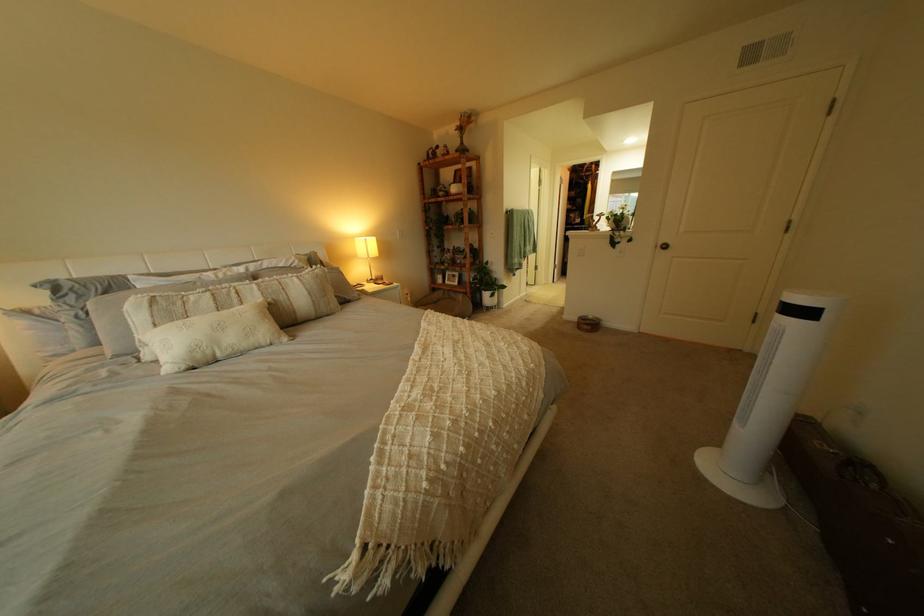
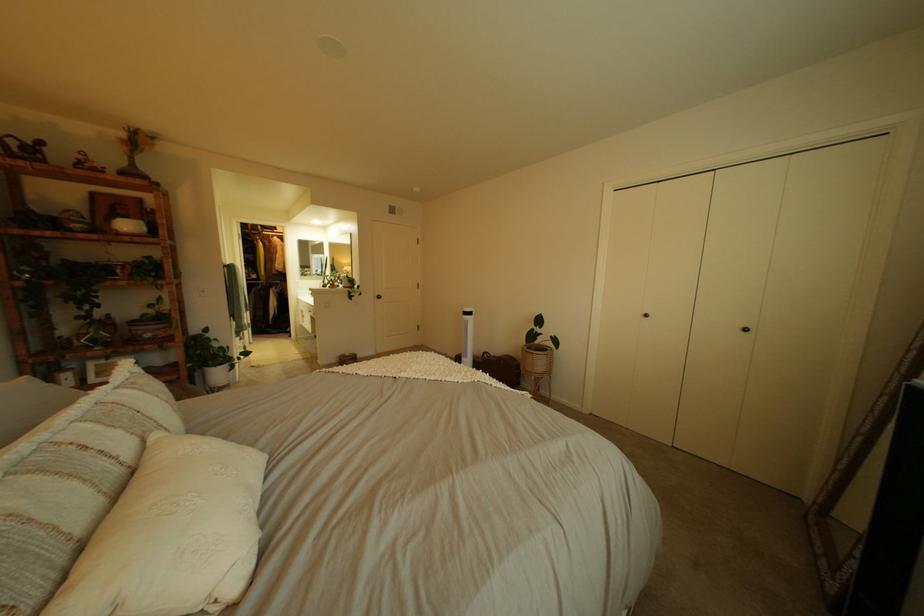
Where in the second image is the point corresponding to the point at 275,302 from the first image?

(172, 436)